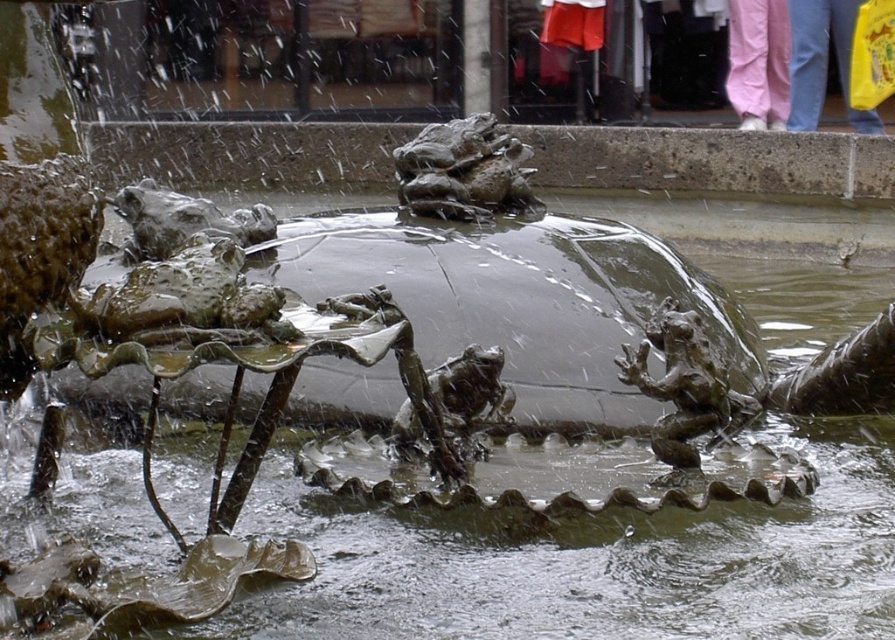
Which is more to the left, bronze textured frog at center or bronze textured frog at upper center?

bronze textured frog at upper center

Can you confirm if bronze textured frog at center is positioned to the left of bronze textured frog at upper center?

In fact, bronze textured frog at center is to the right of bronze textured frog at upper center.

Who is more forward, (680, 310) or (414, 192)?

Point (680, 310)

This screenshot has height=640, width=895. Find the location of `bronze textured frog at center`. bronze textured frog at center is located at coordinates (684, 385).